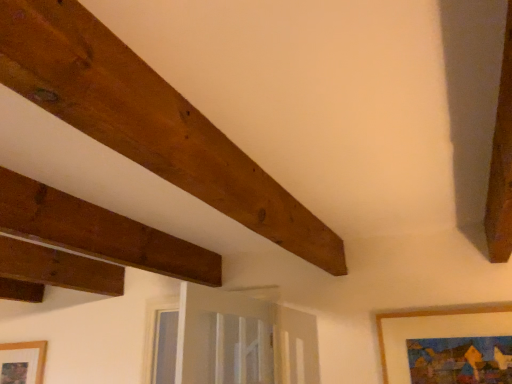
What are the coordinates of `brown wooden plank at upper left` in the screenshot? It's located at (148, 121).

Is the depth of wooden picture frame at lower left, the first picture frame viewed from the left, greater than that of brown wooden plank at upper left?

Yes, wooden picture frame at lower left, the first picture frame viewed from the left, is further from the camera.

Could you tell me if wooden picture frame at lower left, which appears as the first picture frame when ordered from the bottom, is facing brown wooden plank at upper left?

No.

Between point (1, 344) and point (42, 35), which one is positioned in front?

The point (42, 35) is closer.

I want to click on plank in front of the wooden picture frame at lower left, the first picture frame viewed from the left, so click(x=148, y=121).

From a real-world perspective, which object rests below the other?

wooden picture frame at lower left, arranged as the 1th picture frame when viewed from the back.

Could you tell me if wooden picture frame at lower left, arranged as the 1th picture frame when viewed from the back, is turned towards wooden framed painting at lower right, the 2th picture frame in the left-to-right sequence?

No.

Looking at this image, considering the sizes of objects wooden picture frame at lower left, the second picture frame when ordered from right to left, and wooden framed painting at lower right, the 1th picture frame viewed from the top, in the image provided, who is smaller, wooden picture frame at lower left, the second picture frame when ordered from right to left, or wooden framed painting at lower right, the 1th picture frame viewed from the top,?

wooden picture frame at lower left, the second picture frame when ordered from right to left.

Considering the positions of point (27, 370) and point (384, 380), is point (27, 370) closer or farther from the camera than point (384, 380)?

Point (27, 370) is farther from the camera than point (384, 380).

Based on the photo, between brown wooden plank at upper left and wooden framed painting at lower right, the 1th picture frame viewed from the top, which one has smaller size?

wooden framed painting at lower right, the 1th picture frame viewed from the top, is smaller.

Is wooden framed painting at lower right, the first picture frame when ordered from right to left, at the back of brown wooden plank at upper left?

No, brown wooden plank at upper left is not facing the opposite direction of wooden framed painting at lower right, the first picture frame when ordered from right to left.

From the image's perspective, is brown wooden plank at upper left on wooden framed painting at lower right, the 1th picture frame viewed from the top?

Yes, from the image's perspective, brown wooden plank at upper left is on top of wooden framed painting at lower right, the 1th picture frame viewed from the top.

How much distance is there between brown wooden plank at upper left and wooden framed painting at lower right, the 2th picture frame in the left-to-right sequence?

The distance of brown wooden plank at upper left from wooden framed painting at lower right, the 2th picture frame in the left-to-right sequence, is 1.28 meters.

Is point (485, 310) less distant than point (11, 371)?

Yes.

I want to click on picture frame that is above the wooden picture frame at lower left, which is the 2th picture frame in front-to-back order (from a real-world perspective), so click(431, 315).

Is wooden framed painting at lower right, the 2th picture frame in the left-to-right sequence, smaller than wooden picture frame at lower left, arranged as the 1th picture frame when viewed from the back?

No, wooden framed painting at lower right, the 2th picture frame in the left-to-right sequence, is not smaller than wooden picture frame at lower left, arranged as the 1th picture frame when viewed from the back.

Consider the image. Is wooden framed painting at lower right, acting as the 2th picture frame starting from the bottom, directly adjacent to wooden picture frame at lower left, the second picture frame when ordered from right to left?

wooden framed painting at lower right, acting as the 2th picture frame starting from the bottom, and wooden picture frame at lower left, the second picture frame when ordered from right to left, are clearly separated.

How much distance is there between wooden framed painting at lower right, the 2th picture frame in the left-to-right sequence, and brown wooden plank at upper left?

wooden framed painting at lower right, the 2th picture frame in the left-to-right sequence, and brown wooden plank at upper left are 1.28 meters apart from each other.

From the picture: Which object is thinner, wooden framed painting at lower right, the second picture frame when ordered from back to front, or brown wooden plank at upper left?

wooden framed painting at lower right, the second picture frame when ordered from back to front.

The height and width of the screenshot is (384, 512). Find the location of `the 1st picture frame behind the brown wooden plank at upper left`. the 1st picture frame behind the brown wooden plank at upper left is located at coordinates (431, 315).

Is wooden framed painting at lower right, the 2th picture frame in the left-to-right sequence, in contact with brown wooden plank at upper left?

No, wooden framed painting at lower right, the 2th picture frame in the left-to-right sequence, is not touching brown wooden plank at upper left.

From the image's perspective, relative to wooden picture frame at lower left, the second picture frame when ordered from right to left, is brown wooden plank at upper left above or below?

brown wooden plank at upper left is situated higher than wooden picture frame at lower left, the second picture frame when ordered from right to left, in the image.

Is brown wooden plank at upper left turned away from wooden picture frame at lower left, the first picture frame viewed from the left?

No, wooden picture frame at lower left, the first picture frame viewed from the left, is not at the back of brown wooden plank at upper left.

Are brown wooden plank at upper left and wooden picture frame at lower left, the first picture frame viewed from the left, far apart?

Yes.

You are a GUI agent. You are given a task and a screenshot of the screen. Output one action in this format:
    pyautogui.click(x=<x>, y=<y>)
    Task: Click on the plank in front of the wooden picture frame at lower left, the second picture frame in the top-to-bottom sequence
    This screenshot has height=384, width=512.
    Given the screenshot: What is the action you would take?
    pyautogui.click(x=148, y=121)

Starting from the brown wooden plank at upper left, which picture frame is the 2nd one behind? Please provide its 2D coordinates.

[(22, 362)]

You are a GUI agent. You are given a task and a screenshot of the screen. Output one action in this format:
    pyautogui.click(x=<x>, y=<y>)
    Task: Click on the picture frame above the wooden picture frame at lower left, the second picture frame when ordered from right to left (from the image's perspective)
    Image resolution: width=512 pixels, height=384 pixels.
    Given the screenshot: What is the action you would take?
    pyautogui.click(x=431, y=315)

From the image, which object appears to be farther from wooden framed painting at lower right, the 1th picture frame viewed from the top, wooden picture frame at lower left, arranged as the 1th picture frame when viewed from the back, or brown wooden plank at upper left?

wooden picture frame at lower left, arranged as the 1th picture frame when viewed from the back, lies further to wooden framed painting at lower right, the 1th picture frame viewed from the top, than the other object.

Which object lies further to the anchor point brown wooden plank at upper left, wooden framed painting at lower right, marked as the first picture frame in a front-to-back arrangement, or wooden picture frame at lower left, arranged as the 1th picture frame when viewed from the back?

wooden picture frame at lower left, arranged as the 1th picture frame when viewed from the back, is positioned further to the anchor brown wooden plank at upper left.

Considering their positions, is wooden framed painting at lower right, the 1th picture frame viewed from the top, positioned further to wooden picture frame at lower left, the second picture frame when ordered from right to left, than brown wooden plank at upper left?

Among the two, wooden framed painting at lower right, the 1th picture frame viewed from the top, is located further to wooden picture frame at lower left, the second picture frame when ordered from right to left.

When comparing their distances from brown wooden plank at upper left, does wooden picture frame at lower left, the second picture frame in the top-to-bottom sequence, or wooden framed painting at lower right, acting as the 2th picture frame starting from the bottom, seem closer?

wooden framed painting at lower right, acting as the 2th picture frame starting from the bottom, lies closer to brown wooden plank at upper left than the other object.

From the image, which object appears to be nearer to wooden framed painting at lower right, the 2th picture frame in the left-to-right sequence, brown wooden plank at upper left or wooden picture frame at lower left, the first picture frame viewed from the left?

The object closer to wooden framed painting at lower right, the 2th picture frame in the left-to-right sequence, is brown wooden plank at upper left.

Looking at the image, which one is located closer to wooden picture frame at lower left, the first picture frame viewed from the left, brown wooden plank at upper left or wooden framed painting at lower right, the first picture frame when ordered from right to left?

The object closer to wooden picture frame at lower left, the first picture frame viewed from the left, is brown wooden plank at upper left.

This screenshot has width=512, height=384. I want to click on plank situated between wooden picture frame at lower left, the first picture frame viewed from the left, and wooden framed painting at lower right, the second picture frame when ordered from back to front, from left to right, so click(x=148, y=121).